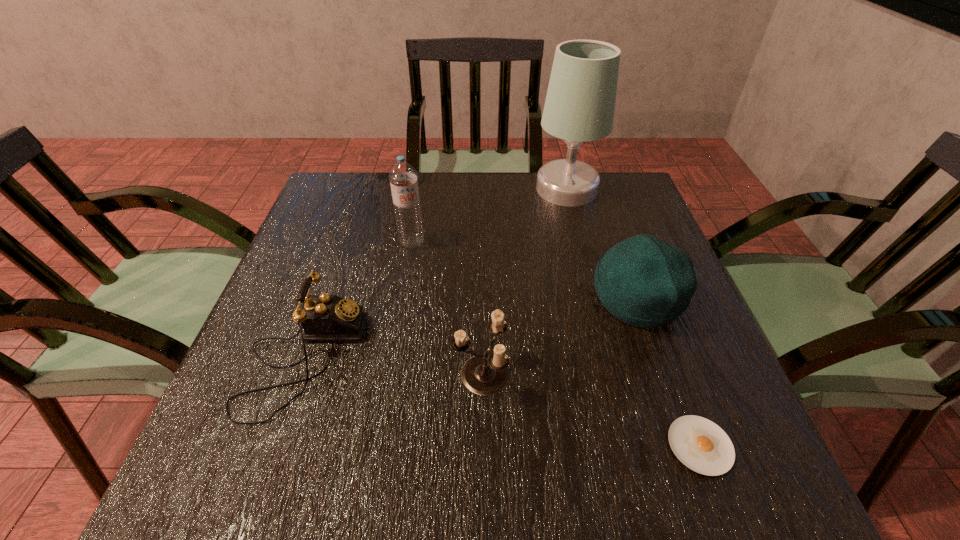
Where is `beanie located in the right edge section of the desktop`? beanie located in the right edge section of the desktop is located at coordinates (643, 281).

Image resolution: width=960 pixels, height=540 pixels. I want to click on egg yolk that is positioned at the right edge, so click(700, 444).

Find the location of a particular element. This screenshot has width=960, height=540. object that is at the far right corner is located at coordinates (580, 103).

Image resolution: width=960 pixels, height=540 pixels. Identify the location of object present at the near right corner. (700, 444).

At what (x,y) coordinates should I click in order to perform the action: click on vacant space at the far edge of the desktop. Please return your answer as a coordinate pair (x, y). This screenshot has width=960, height=540. Looking at the image, I should click on (479, 204).

In order to click on vacant area at the near edge of the desktop in this screenshot , I will do `click(492, 464)`.

In the image, there is a desktop. At what (x,y) coordinates should I click in order to perform the action: click on vacant space at the left edge. Please return your answer as a coordinate pair (x, y). The image size is (960, 540). Looking at the image, I should click on (305, 347).

Locate an element on the screen. The width and height of the screenshot is (960, 540). free space at the right edge of the desktop is located at coordinates (726, 431).

I want to click on vacant space at the far left corner of the desktop, so click(x=357, y=184).

I want to click on blank space at the far right corner, so click(x=612, y=197).